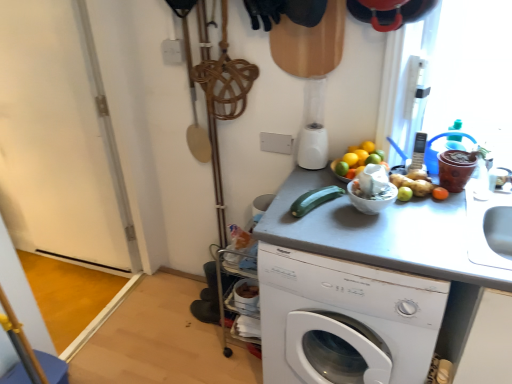
Locate an element on the screen. The width and height of the screenshot is (512, 384). free location to the right of green matte cucumber at center is located at coordinates (356, 213).